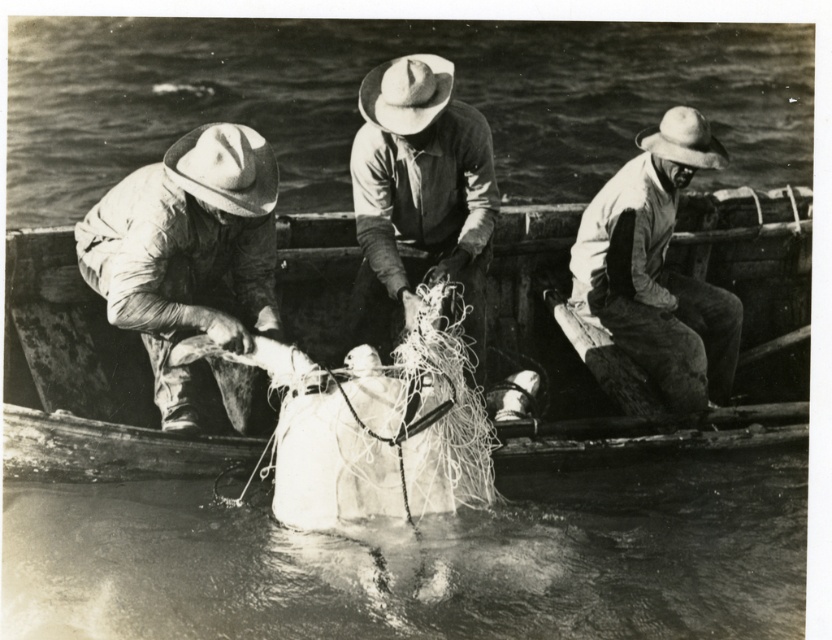
You are a photographer standing on the dock, and you want to take a photo of the white cotton shirt at right and the rough fabric hat at center. Which object is closer to you?

The white cotton shirt at right is closer to you because it is further to the viewer than the rough fabric hat at center.